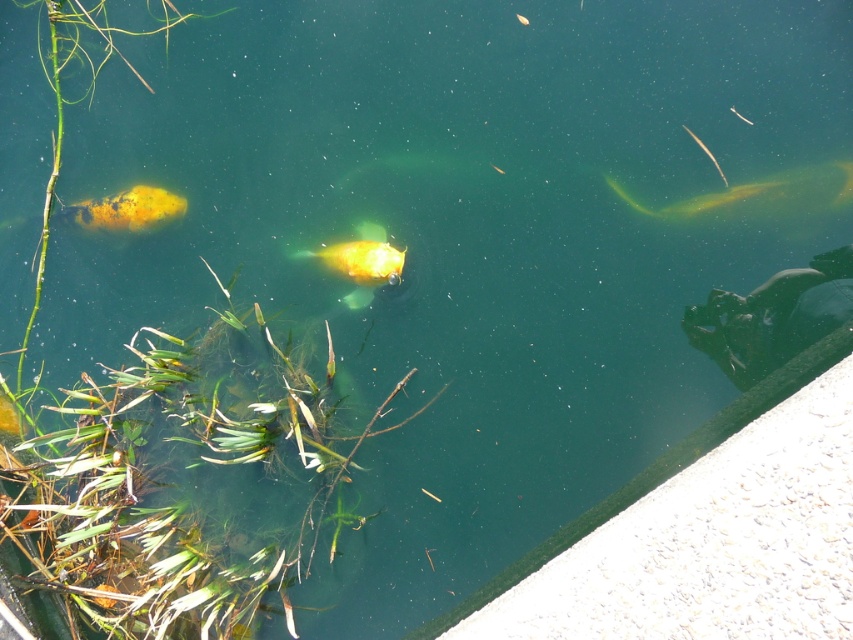
You are a photographer aiming to capture both the shiny orange fish at left and the translucent yellow fish at upper right in the same frame. Based on their positions and sizes, which fish would appear closer to the camera in the photo?

The shiny orange fish at left would appear closer to the camera because it is not as tall as the translucent yellow fish at upper right, indicating it is nearer.

You are standing on the concrete edge and want to observe the shiny orange fish at left. Where should you look relative to your position?

You should look towards the left side of the water surface because the shiny orange fish at left is located at point (x=126, y=209), which is on the left relative to your position on the concrete edge.